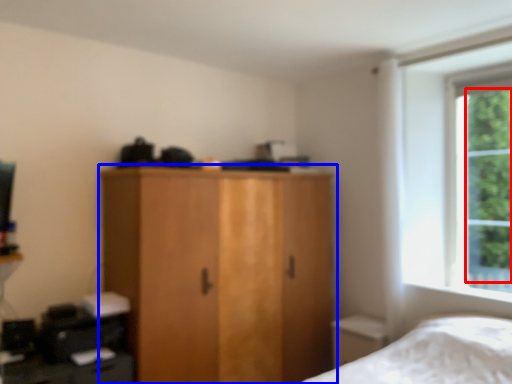
Question: Which object is further to the camera taking this photo, tree (highlighted by a red box) or cupboard (highlighted by a blue box)?

Choices:
 (A) tree
 (B) cupboard

Answer: (A)